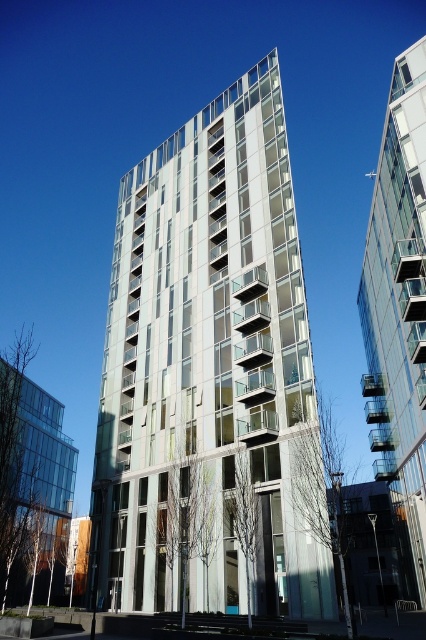
You are a drone operator tasked with flying a drone between two skyscrapers. The metallic glass building at center and the transparent glass building at upper right are in your path. Given that your drone has a maximum flight distance of 15 meters, can it safely navigate between these two buildings without exceeding its range?

The metallic glass building at center is 14.67 meters from the transparent glass building at upper right. Since the drone has a maximum flight distance of 15 meters, it can safely navigate between them as the distance is within the drone operator limits.

You are standing on the ground floor of the metallic glass building at center and want to look at the transparent glass building at upper right. Which direction should you look to see it?

The transparent glass building at upper right is located below the metallic glass building at center, so you should look downward to see it.

You are standing on the street looking at the two buildings in the image. Which building would appear larger to you, the metallic glass building at center or the transparent glass building at upper right?

The metallic glass building at center appears larger because it is closer to the viewer than the transparent glass building at upper right.